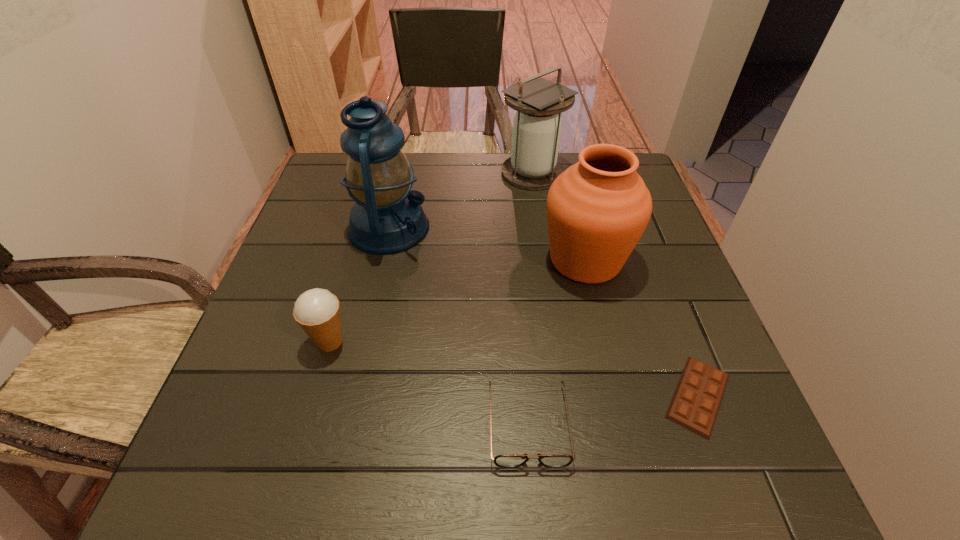
You are a GUI agent. You are given a task and a screenshot of the screen. Output one action in this format:
    pyautogui.click(x=<x>, y=<y>)
    Task: Click on the free location located 0.170m on the front of the urn
    Image resolution: width=960 pixels, height=540 pixels.
    Given the screenshot: What is the action you would take?
    pyautogui.click(x=610, y=362)

This screenshot has width=960, height=540. What are the coordinates of `free point located 0.090m on the back of the third shortest object` in the screenshot? It's located at (x=344, y=292).

What are the coordinates of `free space located 0.050m on the front-facing side of the sunglasses` in the screenshot? It's located at (535, 502).

Identify the location of blank space located on the left of the chocolate bar. (443, 396).

Image resolution: width=960 pixels, height=540 pixels. Identify the location of object present at the near edge. (507, 461).

Where is `lantern present at the left edge`? lantern present at the left edge is located at coordinates [x=387, y=217].

At what (x,y) coordinates should I click in order to perform the action: click on icecream positioned at the left edge. Please return your answer as a coordinate pair (x, y). The image size is (960, 540). Looking at the image, I should click on (317, 311).

The width and height of the screenshot is (960, 540). I want to click on urn that is positioned at the right edge, so click(x=597, y=209).

Image resolution: width=960 pixels, height=540 pixels. I want to click on chocolate bar that is positioned at the right edge, so click(696, 401).

The image size is (960, 540). Identify the location of object present at the far left corner. (387, 217).